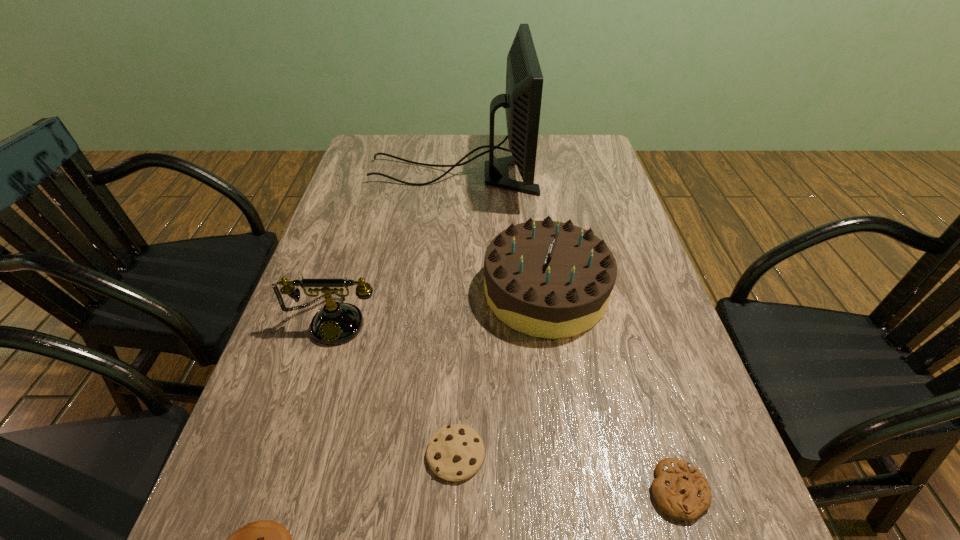
Identify the location of unoccupied position between the third shortest object and the birthday cake. (501, 373).

Locate an element on the screen. This screenshot has width=960, height=540. vacant point located between the birthday cake and the rightmost cookie is located at coordinates (612, 391).

Identify the location of object that is the second closest one to the birthday cake. (455, 453).

In order to click on object that stands as the third closest to the fourth tallest object in this screenshot , I will do `click(336, 323)`.

Where is `the closest cookie to the second shortest object`? This screenshot has height=540, width=960. the closest cookie to the second shortest object is located at coordinates (455, 453).

You are a GUI agent. You are given a task and a screenshot of the screen. Output one action in this format:
    pyautogui.click(x=<x>, y=<y>)
    Task: Click on the cookie that is the nearest to the telephone
    
    Given the screenshot: What is the action you would take?
    pyautogui.click(x=455, y=453)

Image resolution: width=960 pixels, height=540 pixels. What are the coordinates of `free location that satisfies the following two spatial constraints: 1. on the front-facing side of the second shortest object; 2. on the right side of the birthday cake` in the screenshot? It's located at (575, 490).

You are a GUI agent. You are given a task and a screenshot of the screen. Output one action in this format:
    pyautogui.click(x=<x>, y=<y>)
    Task: Click on the free space in the image that satisfies the following two spatial constraints: 1. on the front-facing side of the birthday cake; 2. on the dial of the telephone
    The image size is (960, 540).
    Given the screenshot: What is the action you would take?
    pyautogui.click(x=550, y=320)

In order to click on vacant point that satisfies the following two spatial constraints: 1. on the back side of the tallest cookie; 2. on the screen side of the tallest object in this screenshot , I will do `click(468, 174)`.

The image size is (960, 540). What are the coordinates of `vacant area that satisfies the following two spatial constraints: 1. on the front-facing side of the rightmost cookie; 2. on the left side of the birthday cake` in the screenshot? It's located at (575, 490).